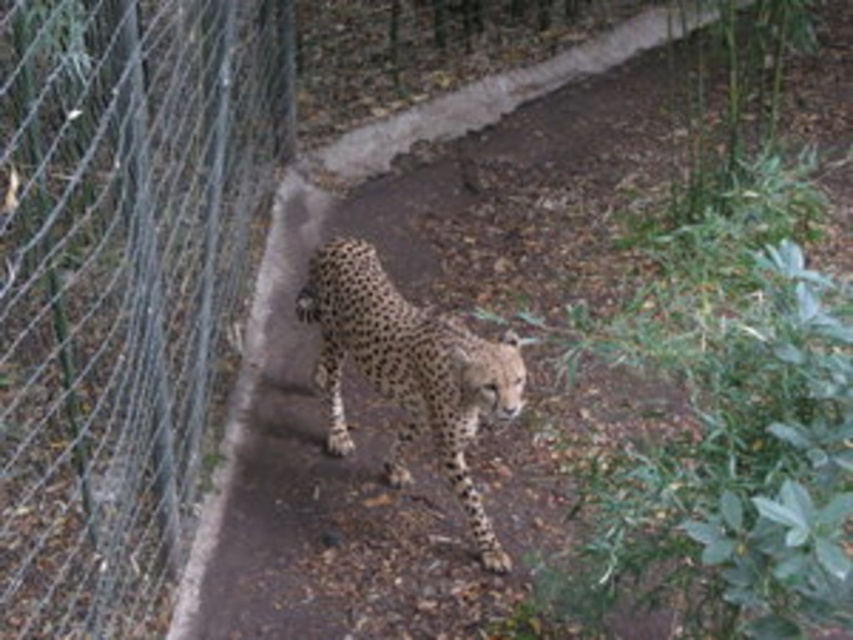
Is spotted fur cheetah at center bigger than brown dirt path at center?

Incorrect, spotted fur cheetah at center is not larger than brown dirt path at center.

Does point (500, 340) come farther from viewer compared to point (505, 74)?

No, (500, 340) is closer to viewer.

Where is `spotted fur cheetah at center`? The height and width of the screenshot is (640, 853). spotted fur cheetah at center is located at coordinates (408, 369).

Does point (119, 570) come farther from viewer compared to point (329, 273)?

No.

Does wire mesh fence at left lie behind spotted fur cheetah at center?

No, it is in front of spotted fur cheetah at center.

Locate an element on the screen. wire mesh fence at left is located at coordinates (122, 284).

Who is more forward, (x=181, y=218) or (x=189, y=627)?

Positioned in front is point (x=189, y=627).

Can you confirm if wire mesh fence at left is shorter than brown dirt path at center?

No.

What do you see at coordinates (122, 284) in the screenshot? I see `wire mesh fence at left` at bounding box center [122, 284].

Locate an element on the screen. The width and height of the screenshot is (853, 640). wire mesh fence at left is located at coordinates (122, 284).